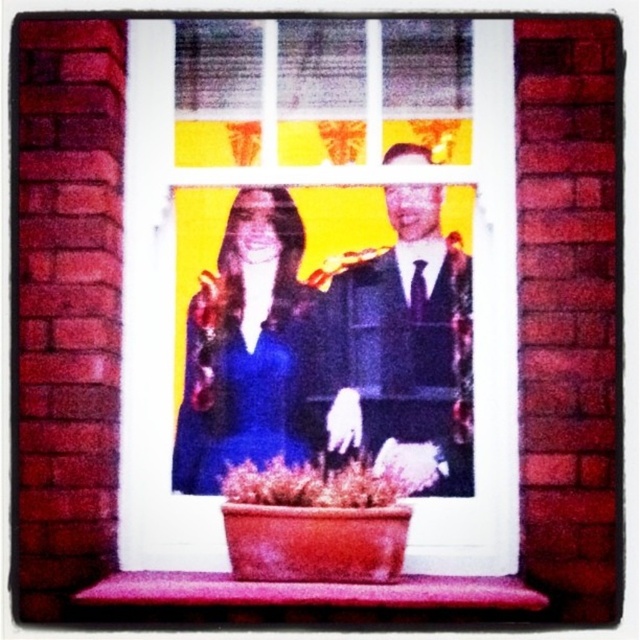
Can you confirm if matte blue dress at center is smaller than green matte plant at center?

No.

Where is `matte blue dress at center`? matte blue dress at center is located at coordinates (248, 348).

At what (x,y) coordinates should I click in order to perform the action: click on matte blue dress at center. Please return your answer as a coordinate pair (x, y). Image resolution: width=640 pixels, height=640 pixels. Looking at the image, I should click on (248, 348).

Find the location of a particular element. matte blue dress at center is located at coordinates (248, 348).

Is point (211, 600) closer to camera compared to point (276, 468)?

Yes, point (211, 600) is in front of point (276, 468).

Is pink matte window sill at lower center above green matte plant at center?

No.

Identify the location of pink matte window sill at lower center. [x=310, y=592].

At what (x,y) coordinates should I click in order to perform the action: click on pink matte window sill at lower center. Please return your answer as a coordinate pair (x, y). Looking at the image, I should click on (310, 592).

Can you confirm if white plastic window frame at center is taller than pink matte window sill at lower center?

Indeed, white plastic window frame at center has a greater height compared to pink matte window sill at lower center.

Can you confirm if white plastic window frame at center is positioned below pink matte window sill at lower center?

Actually, white plastic window frame at center is above pink matte window sill at lower center.

Is point (365, 32) more distant than point (497, 598)?

Yes, point (365, 32) is farther from viewer.

Where is `white plastic window frame at center`? white plastic window frame at center is located at coordinates (173, 316).